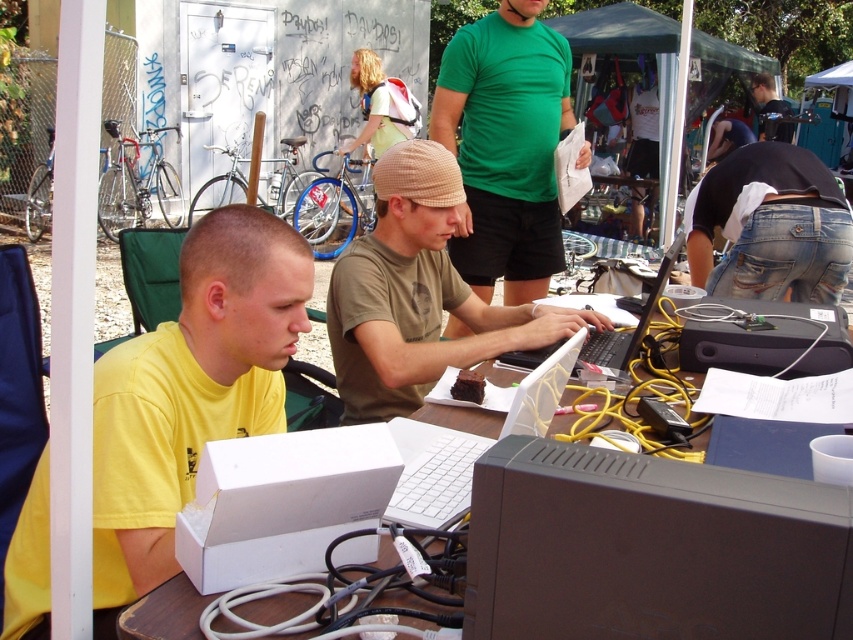
You are a technician who needs to reach the black plastic monitor at lower right while standing 30 inches away from the table. Can you comfortably access it without moving the table?

The black plastic monitor at lower right is 25.98 inches away from the camera, which is within the 30 inches distance you are standing from the table. Therefore, you can comfortably access it without moving the table.

You are a technician who needs to access the khaki cotton cap at center. However, there is a black plastic monitor at lower right blocking your path. Can you move the monitor to reach the cap?

The black plastic monitor at lower right is in front of the khaki cotton cap at center, so you can move the monitor to access the cap.

You are a technician who needs to place a new device that requires 2 meters of clearance above it. You see the black plastic monitor at lower right and the brown wooden table at lower left. Which object is taller and would require more space above it?

The black plastic monitor at lower right is taller than the brown wooden table at lower left, so it would require more space above it.